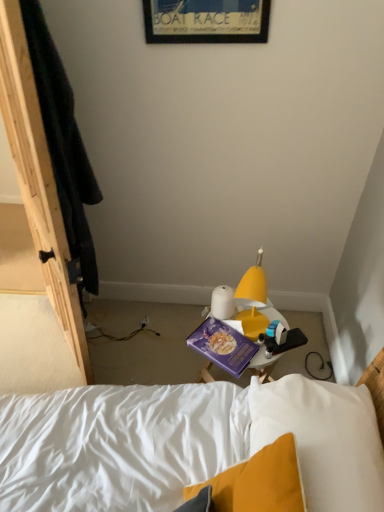
What is the approximate width of wooden framed poster at upper center?

It is 1.33 inches.

In order to click on wooden framed poster at upper center in this screenshot , I will do click(206, 21).

Image resolution: width=384 pixels, height=512 pixels. Describe the element at coordinates (206, 21) in the screenshot. I see `wooden framed poster at upper center` at that location.

Find the location of a particular element. The width and height of the screenshot is (384, 512). purple matte paperback book at center is located at coordinates (223, 346).

Describe the element at coordinates (223, 346) in the screenshot. I see `purple matte paperback book at center` at that location.

What are the coordinates of `wooden framed poster at upper center` in the screenshot? It's located at coord(206,21).

Which is more to the left, purple matte paperback book at center or wooden framed poster at upper center?

wooden framed poster at upper center is more to the left.

In the scene shown: Which object is further away from the camera, purple matte paperback book at center or wooden framed poster at upper center?

purple matte paperback book at center.

Which is in front, point (248, 349) or point (151, 26)?

The point (151, 26) is closer.

From the image's perspective, who appears lower, purple matte paperback book at center or wooden framed poster at upper center?

purple matte paperback book at center appears lower in the image.

From a real-world perspective, is purple matte paperback book at center physically located above or below wooden framed poster at upper center?

In terms of real-world spatial position, purple matte paperback book at center is below wooden framed poster at upper center.

Is purple matte paperback book at center thinner than wooden framed poster at upper center?

No.

Between purple matte paperback book at center and wooden framed poster at upper center, which one has less height?

purple matte paperback book at center.

Which of these two, purple matte paperback book at center or wooden framed poster at upper center, is smaller?

purple matte paperback book at center.

Is purple matte paperback book at center spatially inside wooden framed poster at upper center, or outside of it?

purple matte paperback book at center is not inside wooden framed poster at upper center, it's outside.

Does purple matte paperback book at center touch wooden framed poster at upper center?

purple matte paperback book at center and wooden framed poster at upper center are not in contact.

Is purple matte paperback book at center looking in the opposite direction of wooden framed poster at upper center?

No.

What's the angular difference between purple matte paperback book at center and wooden framed poster at upper center's facing directions?

The angular difference between purple matte paperback book at center and wooden framed poster at upper center is 36.3 degrees.

Identify the location of picture frame above the purple matte paperback book at center (from the image's perspective). (206, 21).

Considering the positions of objects wooden framed poster at upper center and purple matte paperback book at center in the image provided, who is more to the right, wooden framed poster at upper center or purple matte paperback book at center?

A: Positioned to the right is purple matte paperback book at center.

Which object is more forward, wooden framed poster at upper center or purple matte paperback book at center?

wooden framed poster at upper center.

Is point (209, 9) closer or farther from the camera than point (243, 343)?

Point (209, 9) appears to be closer to the viewer than point (243, 343).

From the image's perspective, is wooden framed poster at upper center over purple matte paperback book at center?

Yes, from the image's perspective, wooden framed poster at upper center is above purple matte paperback book at center.

From a real-world perspective, who is located lower, wooden framed poster at upper center or purple matte paperback book at center?

purple matte paperback book at center is physically lower.

Between wooden framed poster at upper center and purple matte paperback book at center, which one has larger width?

purple matte paperback book at center is wider.

Is wooden framed poster at upper center shorter than purple matte paperback book at center?

Answer: No, wooden framed poster at upper center is not shorter than purple matte paperback book at center.

Considering the relative sizes of wooden framed poster at upper center and purple matte paperback book at center in the image provided, is wooden framed poster at upper center smaller than purple matte paperback book at center?

Actually, wooden framed poster at upper center might be larger than purple matte paperback book at center.

Is wooden framed poster at upper center spatially inside purple matte paperback book at center, or outside of it?

wooden framed poster at upper center is not enclosed by purple matte paperback book at center.

Is wooden framed poster at upper center next to purple matte paperback book at center?

No, wooden framed poster at upper center is not with purple matte paperback book at center.

Does wooden framed poster at upper center turn towards purple matte paperback book at center?

No, wooden framed poster at upper center is not aimed at purple matte paperback book at center.

Where is `paperback book below the wooden framed poster at upper center (from a real-world perspective)`? This screenshot has height=512, width=384. paperback book below the wooden framed poster at upper center (from a real-world perspective) is located at coordinates (223, 346).

This screenshot has width=384, height=512. Find the location of `paperback book that is under the wooden framed poster at upper center (from a real-world perspective)`. paperback book that is under the wooden framed poster at upper center (from a real-world perspective) is located at coordinates (223, 346).

Identify the location of picture frame that is in front of the purple matte paperback book at center. This screenshot has height=512, width=384. (206, 21).